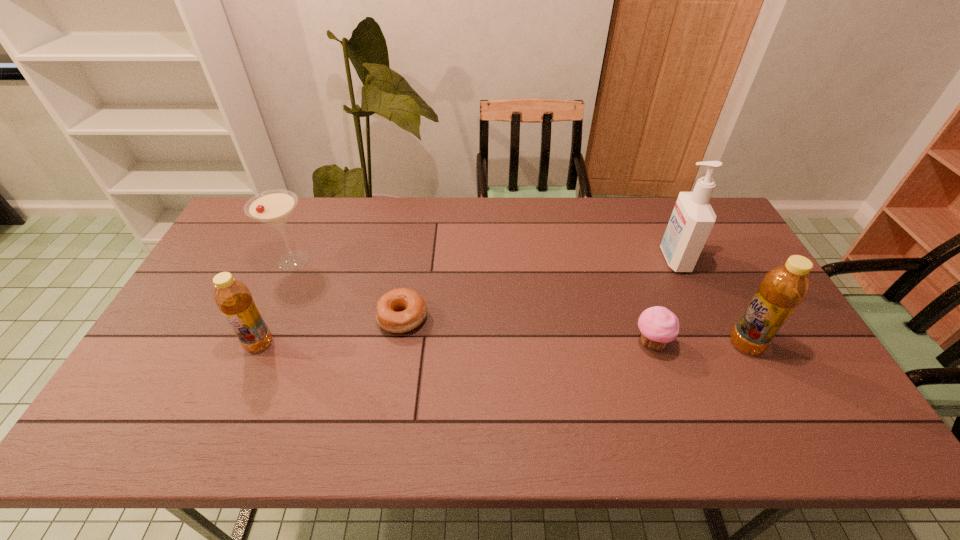
Where is `the left bottle`? The width and height of the screenshot is (960, 540). the left bottle is located at coordinates (233, 298).

You are a GUI agent. You are given a task and a screenshot of the screen. Output one action in this format:
    pyautogui.click(x=<x>, y=<y>)
    Task: Click on the taller bottle
    This screenshot has width=960, height=540.
    Given the screenshot: What is the action you would take?
    pyautogui.click(x=784, y=287)

The height and width of the screenshot is (540, 960). What are the coordinates of `the second tallest object` in the screenshot? It's located at (784, 287).

Identify the location of cleansing agent. (692, 219).

Where is `the fourth object from left to right`? Image resolution: width=960 pixels, height=540 pixels. the fourth object from left to right is located at coordinates (658, 325).

I want to click on cupcake, so click(658, 325).

Locate an element on the screen. martini is located at coordinates (273, 207).

At what (x,y) coordinates should I click in order to perform the action: click on the shortest object. Please return your answer as a coordinate pair (x, y). Looking at the image, I should click on (400, 310).

Locate an element on the screen. This screenshot has height=540, width=960. the third object from left to right is located at coordinates (400, 310).

At what (x,y) coordinates should I click in order to perform the action: click on free space located 0.360m on the right of the left bottle. Please return your answer as a coordinate pair (x, y). Looking at the image, I should click on (408, 343).